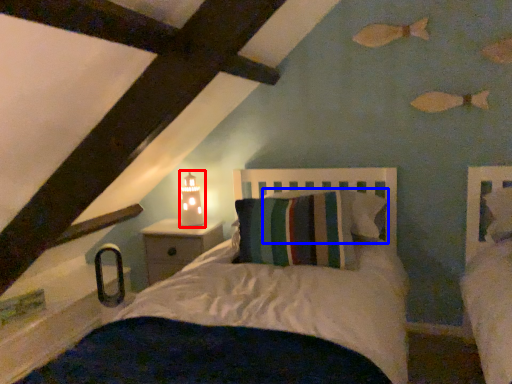
Question: Which point is closer to the camera, table lamp (highlighted by a red box) or pillow (highlighted by a blue box)?

Choices:
 (A) table lamp
 (B) pillow

Answer: (B)